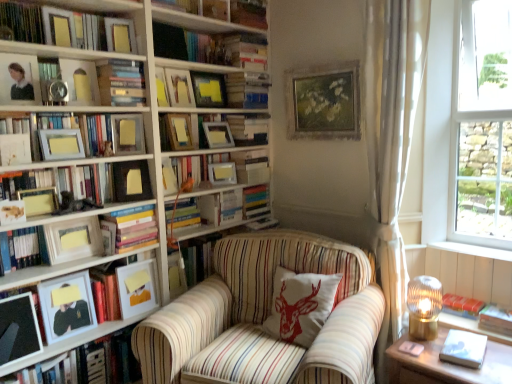
Question: From the image's perspective, would you say wooden picture frame at upper center, arranged as the 17th picture frame when viewed from the left, is shown under matte wooden picture frame at upper center, placed as the fourth picture frame when sorted from right to left?

Choices:
 (A) no
 (B) yes

Answer: (B)

Question: From the image's perspective, is wooden picture frame at upper center, arranged as the 17th picture frame when viewed from the left, located above matte wooden picture frame at upper center, placed as the fourth picture frame when sorted from right to left?

Choices:
 (A) no
 (B) yes

Answer: (A)

Question: From a real-world perspective, is wooden picture frame at upper center, arranged as the 17th picture frame when viewed from the left, on matte wooden picture frame at upper center, placed as the fourth picture frame when sorted from right to left?

Choices:
 (A) yes
 (B) no

Answer: (B)

Question: Can matte wooden picture frame at upper center, the fourteenth picture frame positioned from the left, be found inside wooden picture frame at upper center, the 1th picture frame from the right?

Choices:
 (A) yes
 (B) no

Answer: (B)

Question: Considering the relative sizes of wooden picture frame at upper center, the 1th picture frame from the right, and matte wooden picture frame at upper center, placed as the fourth picture frame when sorted from right to left, in the image provided, is wooden picture frame at upper center, the 1th picture frame from the right, wider than matte wooden picture frame at upper center, placed as the fourth picture frame when sorted from right to left,?

Choices:
 (A) no
 (B) yes

Answer: (A)

Question: Considering their positions, is matte gold picture frame at lower left, the fifteenth picture frame viewed from the right, located in front of or behind matte wooden picture frame at upper center, the fourteenth picture frame positioned from the left?

Choices:
 (A) front
 (B) behind

Answer: (A)

Question: From the image's perspective, is matte gold picture frame at lower left, the fifteenth picture frame viewed from the right, above or below matte wooden picture frame at upper center, placed as the fourth picture frame when sorted from right to left?

Choices:
 (A) above
 (B) below

Answer: (B)

Question: From a real-world perspective, is matte gold picture frame at lower left, the 3th picture frame positioned from the left, positioned above or below matte wooden picture frame at upper center, the fourteenth picture frame positioned from the left?

Choices:
 (A) below
 (B) above

Answer: (A)

Question: Considering the positions of matte gold picture frame at lower left, the fifteenth picture frame viewed from the right, and matte wooden picture frame at upper center, placed as the fourth picture frame when sorted from right to left, in the image, is matte gold picture frame at lower left, the fifteenth picture frame viewed from the right, taller or shorter than matte wooden picture frame at upper center, placed as the fourth picture frame when sorted from right to left,?

Choices:
 (A) tall
 (B) short

Answer: (B)

Question: Is point (76, 226) positioned closer to the camera than point (244, 140)?

Choices:
 (A) farther
 (B) closer

Answer: (B)

Question: From the image's perspective, is matte white picture frame at left, marked as the eighth picture frame in a left-to-right arrangement, located above or below hardcover book at upper center, which appears as the 5th book when viewed from the top?

Choices:
 (A) below
 (B) above

Answer: (A)

Question: Considering the positions of matte white picture frame at left, marked as the eighth picture frame in a left-to-right arrangement, and hardcover book at upper center, arranged as the 15th book when ordered from the bottom, in the image, is matte white picture frame at left, marked as the eighth picture frame in a left-to-right arrangement, bigger or smaller than hardcover book at upper center, arranged as the 15th book when ordered from the bottom,?

Choices:
 (A) big
 (B) small

Answer: (B)

Question: From a real-world perspective, is matte white picture frame at left, marked as the eighth picture frame in a left-to-right arrangement, physically located above or below hardcover book at upper center, arranged as the 15th book when ordered from the bottom?

Choices:
 (A) above
 (B) below

Answer: (B)

Question: Based on their positions, is matte gold picture frame at upper left, which is the eleventh picture frame from right to left, located to the left or right of hardcover books at center, the ninth book when ordered from bottom to top?

Choices:
 (A) right
 (B) left

Answer: (B)

Question: Is matte gold picture frame at upper left, the seventh picture frame viewed from the left, taller or shorter than hardcover books at center, the 11th book when ordered from top to bottom?

Choices:
 (A) short
 (B) tall

Answer: (A)